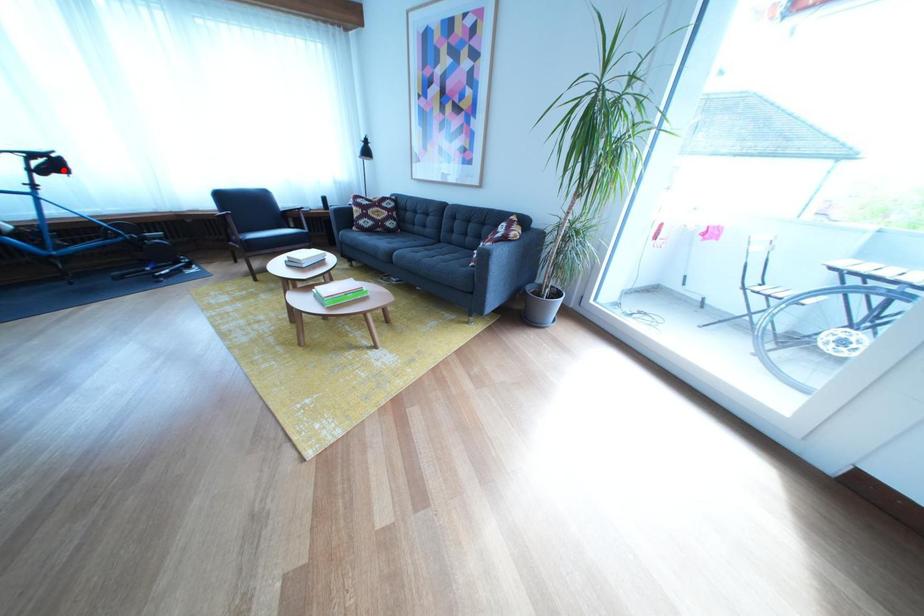
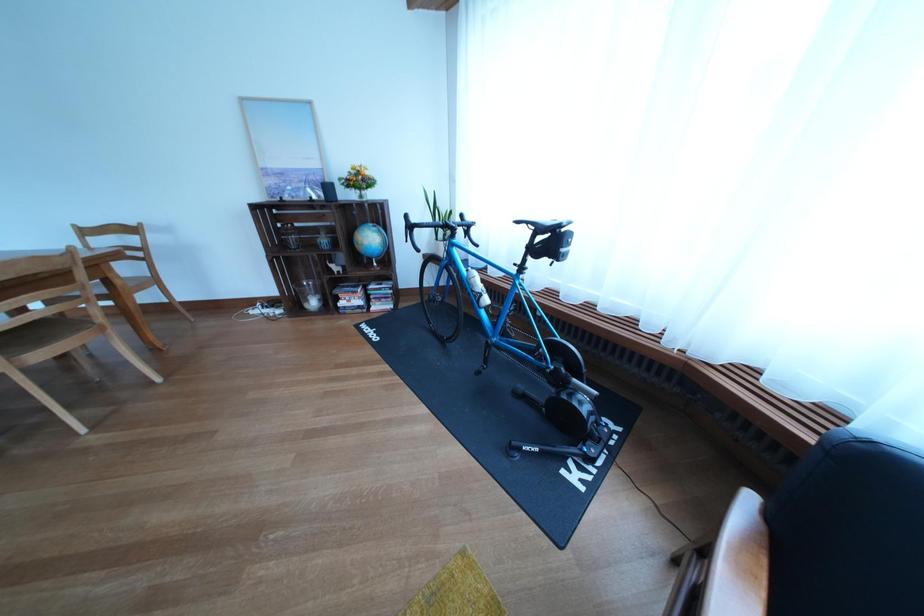
Locate, in the second image, the point that corresponds to the highlighted location in the first image.

(563, 248)